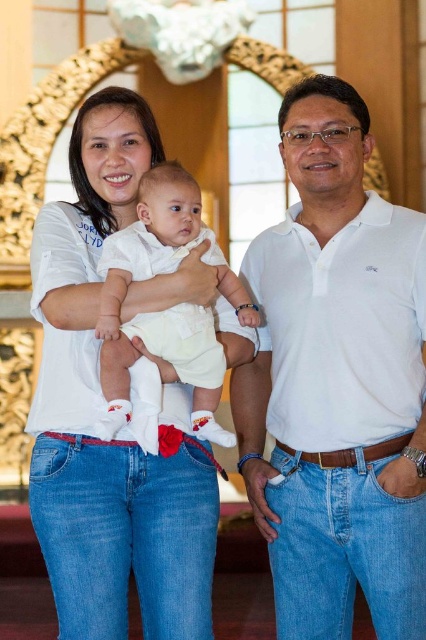
Is white cotton polo shirt at center closer to the viewer compared to white cotton baby at center?

Yes.

Between white cotton polo shirt at center and white cotton baby at center, which one is positioned lower?

white cotton polo shirt at center is below.

Who is more distant from viewer, (301, 116) or (115, 420)?

Point (301, 116)

The width and height of the screenshot is (426, 640). I want to click on white cotton polo shirt at center, so click(x=337, y=384).